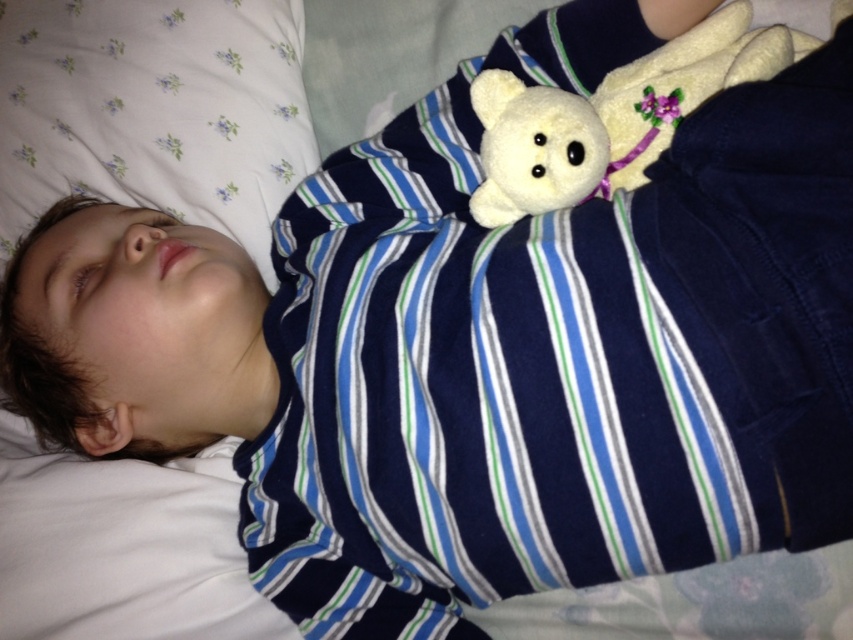
Is white soft pillow at upper left to the right of white plush bear at upper right from the viewer's perspective?

In fact, white soft pillow at upper left is to the left of white plush bear at upper right.

Can you confirm if white soft pillow at upper left is positioned above white plush bear at upper right?

No.

Describe the element at coordinates (154, 109) in the screenshot. I see `white soft pillow at upper left` at that location.

Find the location of a particular element. Image resolution: width=853 pixels, height=640 pixels. white soft pillow at upper left is located at coordinates (154, 109).